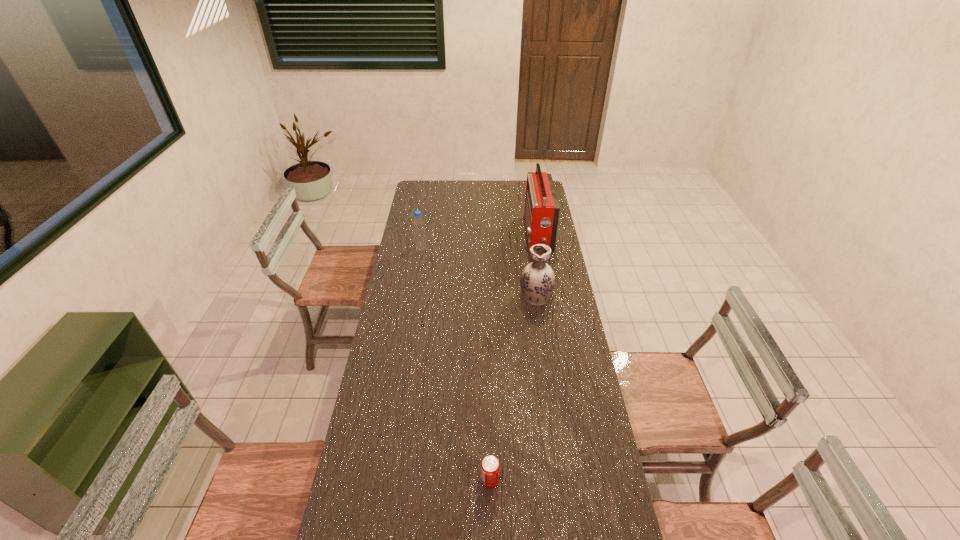
Where is `vacant region located 0.210m with the handle on the side of the third shortest object`? vacant region located 0.210m with the handle on the side of the third shortest object is located at coordinates (530, 254).

Identify the location of vacant space located with the handle on the side of the third shortest object. (529, 243).

This screenshot has height=540, width=960. In order to click on vacant area situated 0.280m with the handle on the side of the third shortest object in this screenshot , I will do `click(529, 245)`.

The image size is (960, 540). I want to click on free space located 0.340m on the front of the water bottle, so click(x=413, y=301).

Where is `free location located on the back of the third object from right to left`? free location located on the back of the third object from right to left is located at coordinates (489, 397).

Image resolution: width=960 pixels, height=540 pixels. I want to click on object situated at the left edge, so click(418, 223).

This screenshot has width=960, height=540. In order to click on radio receiver present at the right edge in this screenshot , I will do `click(541, 214)`.

This screenshot has width=960, height=540. In order to click on vase situated at the right edge in this screenshot , I will do point(537,281).

Image resolution: width=960 pixels, height=540 pixels. In the image, there is a desktop. Identify the location of vacant space at the far edge. (476, 198).

In the image, there is a desktop. At what (x,y) coordinates should I click in order to perform the action: click on vacant region at the left edge. Please return your answer as a coordinate pair (x, y). The height and width of the screenshot is (540, 960). Looking at the image, I should click on (420, 252).